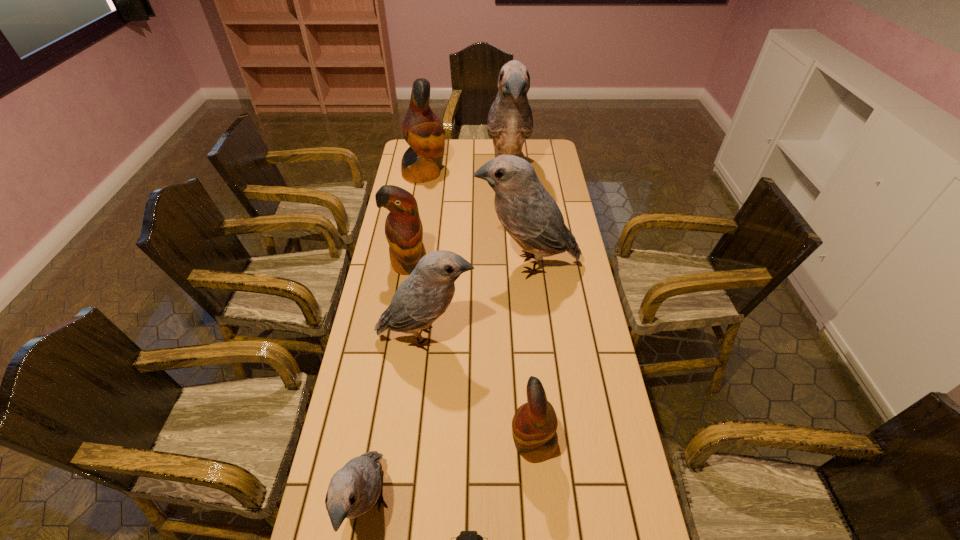
I want to click on the farthest gray parrot, so click(510, 122).

The width and height of the screenshot is (960, 540). Find the location of `the tallest object`. the tallest object is located at coordinates (510, 122).

The width and height of the screenshot is (960, 540). I want to click on the third nearest gray parrot, so click(x=530, y=215).

Where is `the farthest red parrot`? The width and height of the screenshot is (960, 540). the farthest red parrot is located at coordinates (422, 130).

In order to click on the second farthest red parrot in this screenshot , I will do `click(403, 228)`.

You are a GUI agent. You are given a task and a screenshot of the screen. Output one action in this format:
    pyautogui.click(x=<x>, y=<y>)
    Task: Click on the third nearest parrot
    The width and height of the screenshot is (960, 540).
    Given the screenshot: What is the action you would take?
    pyautogui.click(x=424, y=296)

You are a GUI agent. You are given a task and a screenshot of the screen. Output one action in this format:
    pyautogui.click(x=<x>, y=<y>)
    Task: Click on the second nearest gray parrot
    
    Given the screenshot: What is the action you would take?
    pyautogui.click(x=424, y=296)

Where is `the rightmost red parrot`? The height and width of the screenshot is (540, 960). the rightmost red parrot is located at coordinates (534, 425).

You are a GUI agent. You are given a task and a screenshot of the screen. Output one action in this format:
    pyautogui.click(x=<x>, y=<y>)
    Task: Click on the smallest red parrot
    The image size is (960, 540).
    Given the screenshot: What is the action you would take?
    pyautogui.click(x=534, y=425)

Where is `vacant region located on the front-facing side of the tallest object`? vacant region located on the front-facing side of the tallest object is located at coordinates (514, 249).